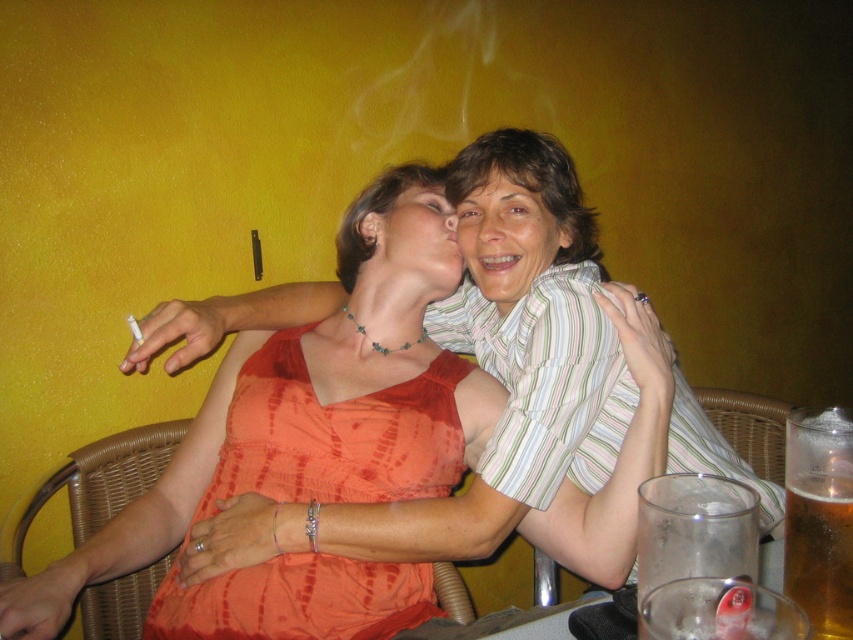
Measure the distance from matte striped shirt at upper center to matte white face at center.

2.97 inches

Who is positioned more to the right, matte striped shirt at upper center or matte white face at center?

Positioned to the right is matte striped shirt at upper center.

The width and height of the screenshot is (853, 640). Describe the element at coordinates (505, 237) in the screenshot. I see `matte striped shirt at upper center` at that location.

Where is `matte striped shirt at upper center`? This screenshot has width=853, height=640. matte striped shirt at upper center is located at coordinates (505, 237).

Can you confirm if translucent glass beer at lower right is wider than matte white face at center?

Incorrect, translucent glass beer at lower right's width does not surpass matte white face at center's.

Is translucent glass beer at lower right to the left of matte white face at center from the viewer's perspective?

Incorrect, translucent glass beer at lower right is not on the left side of matte white face at center.

Is point (844, 541) more distant than point (442, 243)?

No, it is not.

You are a GUI agent. You are given a task and a screenshot of the screen. Output one action in this format:
    pyautogui.click(x=<x>, y=<y>)
    Task: Click on the translucent glass beer at lower right
    
    Given the screenshot: What is the action you would take?
    pyautogui.click(x=819, y=518)

Which is behind, point (833, 408) or point (502, 220)?

The point (502, 220) is behind.

Is point (798, 579) farther from camera compared to point (476, 260)?

No.

Is point (815, 634) closer to viewer compared to point (514, 218)?

Yes, it is.

The height and width of the screenshot is (640, 853). In order to click on translucent glass beer at lower right in this screenshot , I will do `click(819, 518)`.